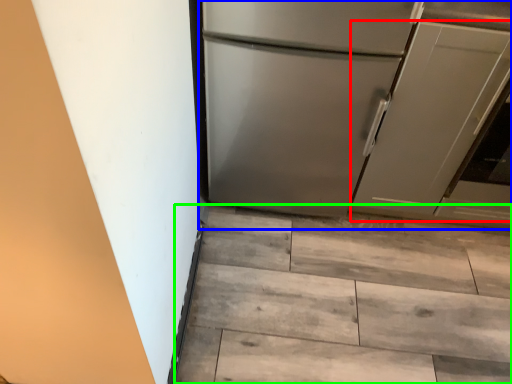
Question: Based on their relative distances, which object is nearer to door (highlighted by a red box)? Choose from refrigerator (highlighted by a blue box) and stairwell (highlighted by a green box).

Choices:
 (A) refrigerator
 (B) stairwell

Answer: (A)